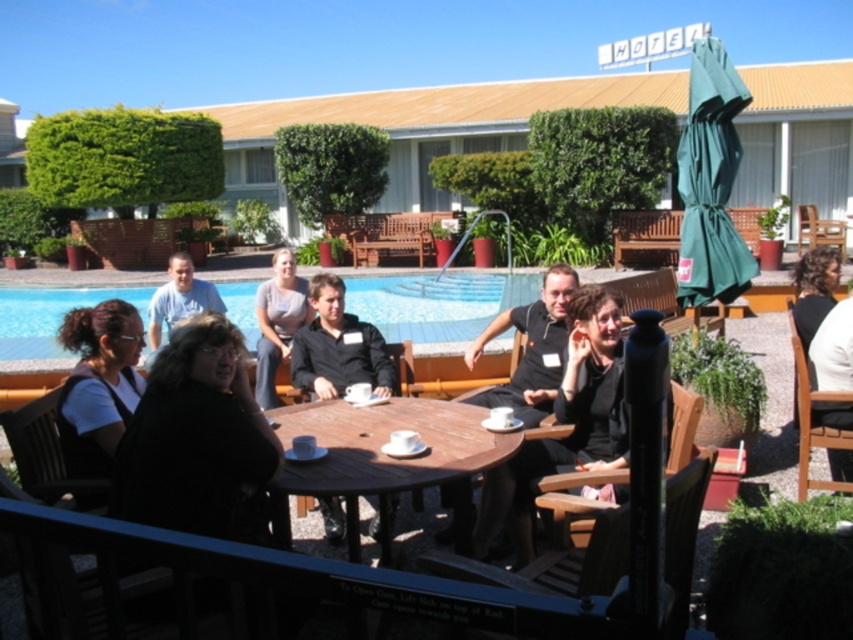
You are a guest at the hotel and want to retrieve your gray cotton shirt at center from the scene described. The blue glass swimming pool at center is in the way. Can you walk around the pool to reach your shirt?

The gray cotton shirt at center is behind the blue glass swimming pool at center, so you can walk around the pool to reach the shirt.